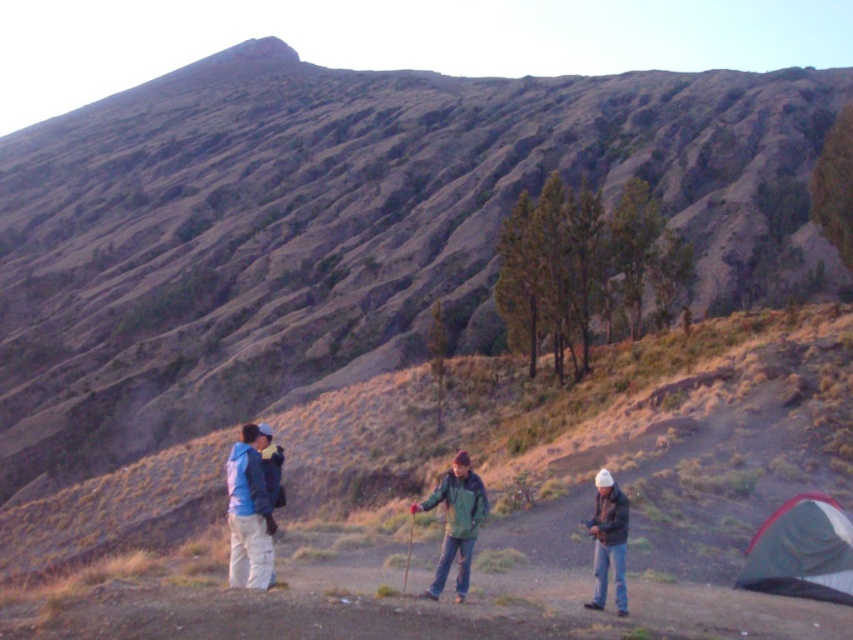
You are a hiker trying to locate your friend who is wearing a white matte jacket at lower right. You are currently near the brushed metal jacket at lower left. Can you see your friend directly?

The brushed metal jacket at lower left is in front of the white matte jacket at lower right, so you cannot see your friend directly because they are behind the person wearing the brushed metal jacket at lower left.

You are navigating through the rugged mountain terrain and need to reach a specific location. You have two points marked on your map as point 1 at coordinates point (260, 531) and point 2 at coordinates point (619, 592). Based on the scene, which point is closer to your current position?

Point 1 at coordinates point (260, 531) is closer to your current position because it is in front of point 2 at coordinates point (619, 592).

You are a hiker who just arrived at the campsite and need to set up your tent. You see the green fabric tent at lower right and the brushed metal jacket at lower left. Which object is closer to you?

The green fabric tent at lower right is closer to you because it is positioned under the brushed metal jacket at lower left, indicating it is in front spatially.